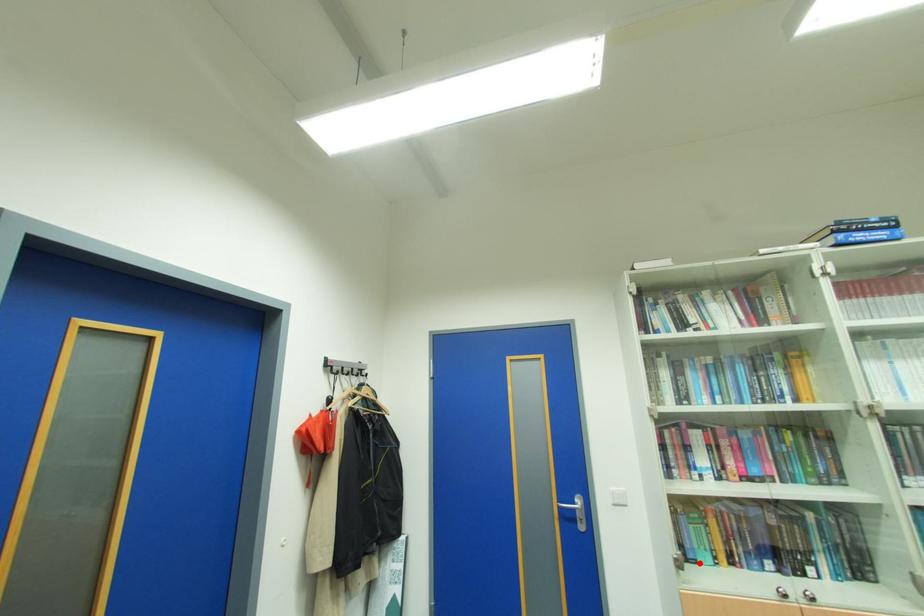
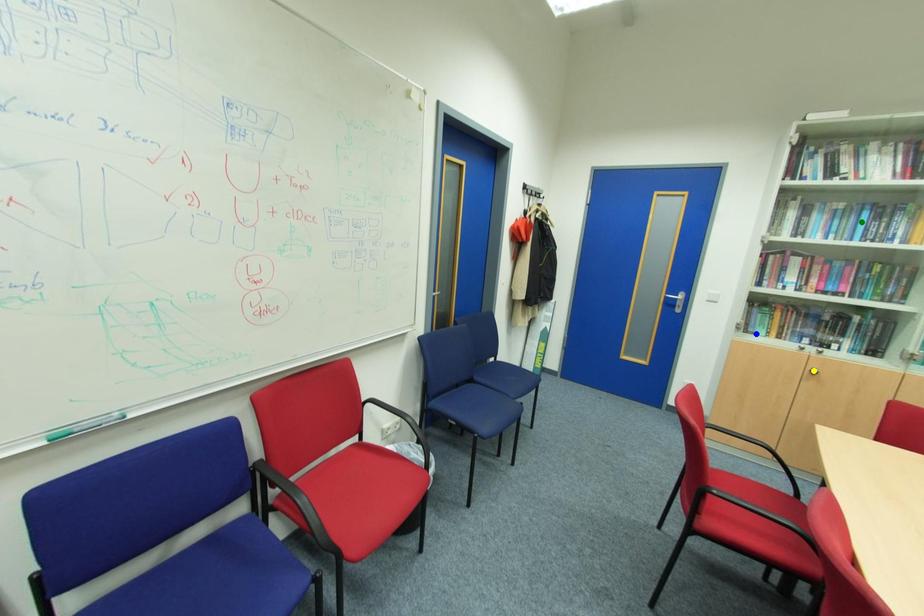
Question: I am providing you with two images of the same scene from different viewpoints. A red point is marked on the first image. You are given multiple points on the second image. Which point in image 2 is actually the same real-world point as the red point in image 1?

Choices:
 (A) blue point
 (B) yellow point
 (C) green point

Answer: (A)